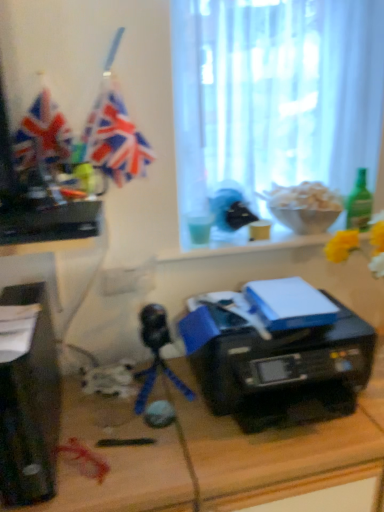
Question: Does point (188, 219) appear closer or farther from the camera than point (321, 294)?

Choices:
 (A) farther
 (B) closer

Answer: (A)

Question: In terms of height, does translucent plastic cup at window look taller or shorter compared to black plastic printer at center?

Choices:
 (A) short
 (B) tall

Answer: (A)

Question: Which object is the farthest from the translucent plastic cup at window?

Choices:
 (A) white sheer curtain at upper center
 (B) black plastic printer at center
 (C) black plastic printer at center
 (D) green glass bottle at right
 (E) black plastic desktop computer at left

Answer: (E)

Question: Estimate the real-world distances between objects in this image. Which object is closer to the black plastic printer at center?

Choices:
 (A) matte plastic flag at upper left
 (B) black plastic desktop computer at left
 (C) black plastic printer at center
 (D) green glass bottle at right
 (E) translucent plastic cup at window

Answer: (C)